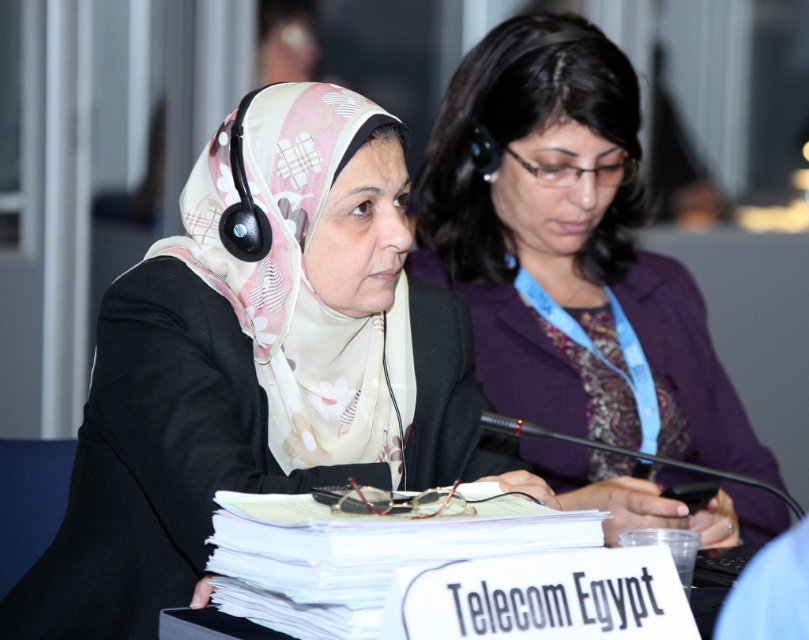
Can you confirm if matte black suit at center is thinner than purple fabric jacket at center?

Incorrect, matte black suit at center's width is not less than purple fabric jacket at center's.

Between matte black suit at center and purple fabric jacket at center, which one is positioned lower?

matte black suit at center

The image size is (809, 640). Find the location of `matte black suit at center`. matte black suit at center is located at coordinates (256, 369).